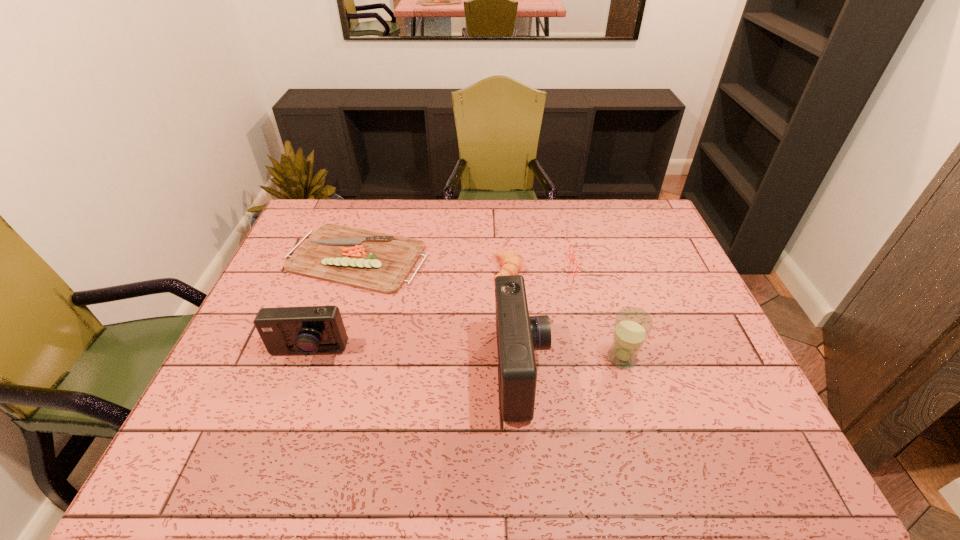
This screenshot has width=960, height=540. I want to click on the left camera, so click(307, 330).

This screenshot has width=960, height=540. What are the coordinates of `the taller camera` in the screenshot? It's located at (518, 335).

The width and height of the screenshot is (960, 540). Find the location of `the tallest object`. the tallest object is located at coordinates (518, 335).

Where is `chopping board`? chopping board is located at coordinates pos(378,262).

Locate an element on the screen. spectacles is located at coordinates (570, 244).

Identify the location of crescent roll. (512, 264).

Find the location of `glass`. glass is located at coordinates (632, 326).

The image size is (960, 540). Identify the location of free space located 0.100m on the front-facing side of the shorter camera. (290, 401).

Locate an element on the screen. The height and width of the screenshot is (540, 960). free space located on the front-facing side of the right camera is located at coordinates (677, 372).

Locate an element on the screen. free space located on the front of the shortest object is located at coordinates (332, 334).